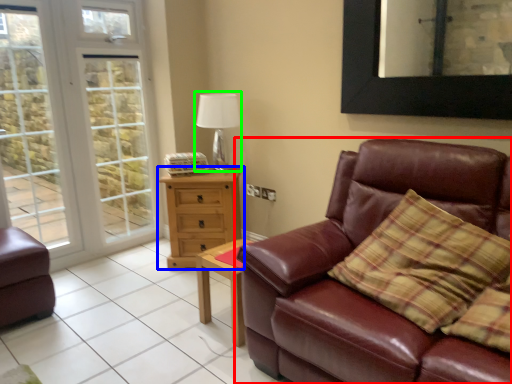
Question: Which is farther away from studio couch (highlighted by a red box)? chest of drawers (highlighted by a blue box) or table lamp (highlighted by a green box)?

Choices:
 (A) chest of drawers
 (B) table lamp

Answer: (B)